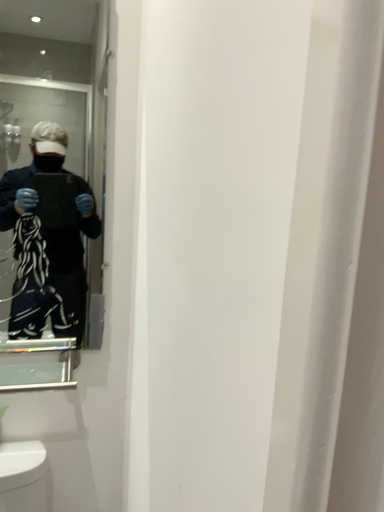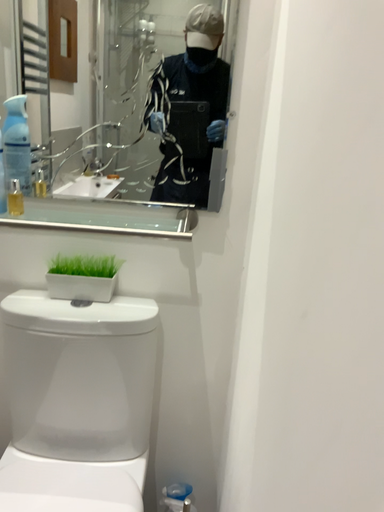
Question: Which way did the camera rotate in the video?

Choices:
 (A) rotated downward
 (B) rotated upward

Answer: (A)